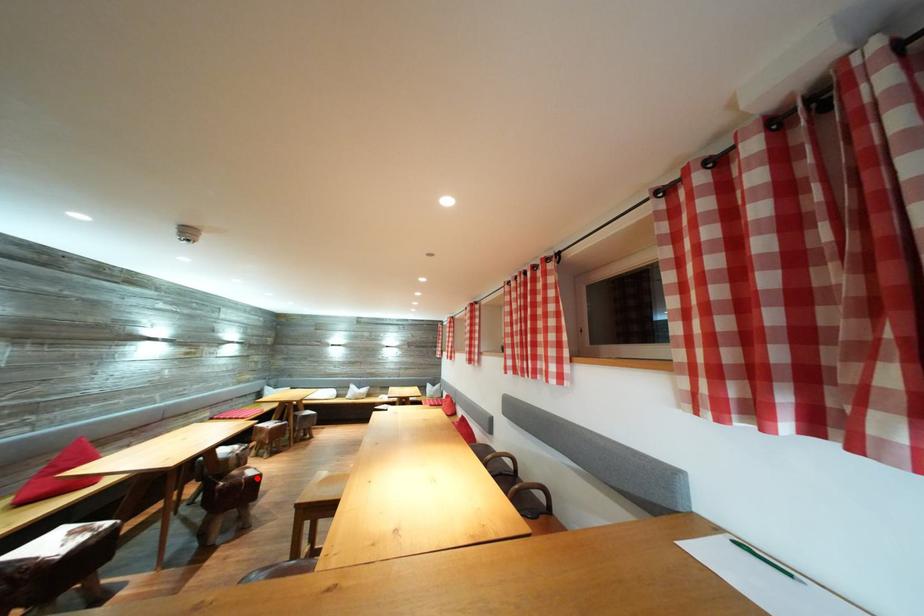
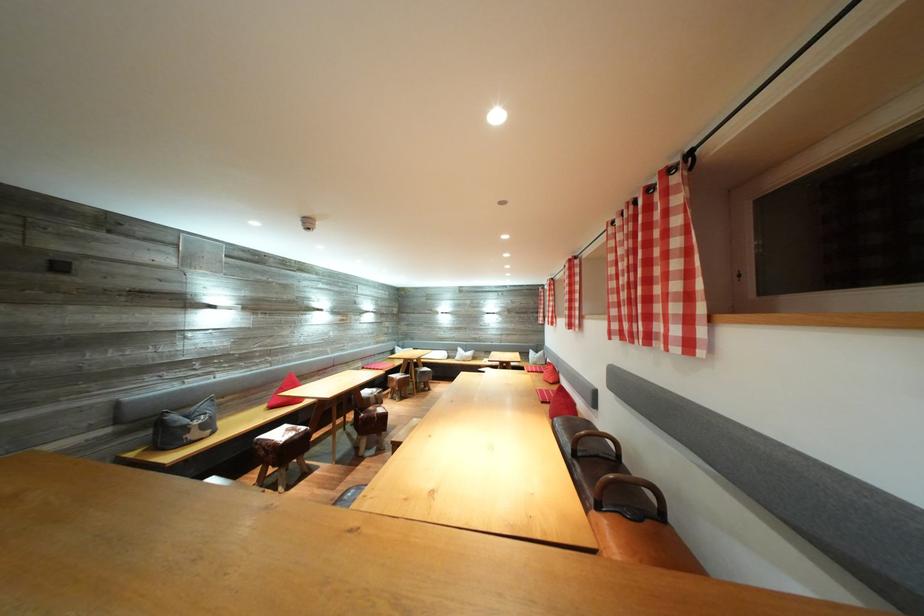
Question: I am providing you with two images of the same scene from different viewpoints. In image1, a red point is highlighted. Considering the same 3D point in image2, which of the following is correct?

Choices:
 (A) It is closer
 (B) It is farther

Answer: (B)